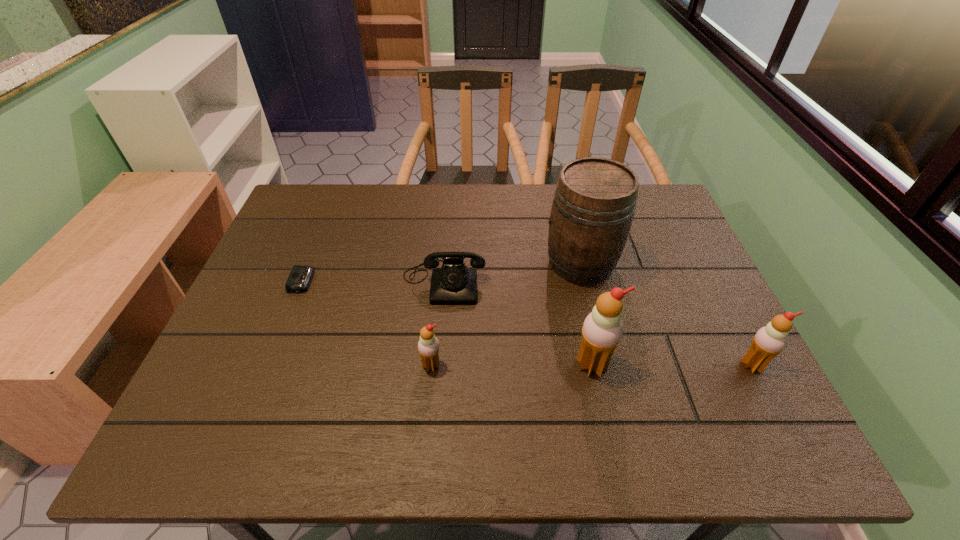
I want to click on free point between the second icecream from right to left and the cider, so click(587, 314).

Locate which object is the fifth closest to the leftmost object. Please provide its 2D coordinates. Your answer should be formatted as a tuple, i.e. [(x, y)], where the tuple contains the x and y coordinates of a point satisfying the conditions above.

[(769, 341)]

Image resolution: width=960 pixels, height=540 pixels. Find the location of `the third closest object relative to the cider`. the third closest object relative to the cider is located at coordinates (769, 341).

Locate an element on the screen. The image size is (960, 540). the second closest icecream to the tallest icecream is located at coordinates (428, 346).

Locate an element on the screen. The width and height of the screenshot is (960, 540). icecream that is the second closest one to the second icecream from right to left is located at coordinates (428, 346).

Where is `vacant space that satisfies the following two spatial constraints: 1. on the side of the cider near the bung hole; 2. at the front with a straw on the tallest icecream`? The width and height of the screenshot is (960, 540). vacant space that satisfies the following two spatial constraints: 1. on the side of the cider near the bung hole; 2. at the front with a straw on the tallest icecream is located at coordinates (605, 365).

You are a GUI agent. You are given a task and a screenshot of the screen. Output one action in this format:
    pyautogui.click(x=<x>, y=<y>)
    Task: Click on the vacant space that satisfies the following two spatial constraints: 1. on the side of the cider near the bung hole; 2. on the front face of the telephone
    This screenshot has width=960, height=540.
    Given the screenshot: What is the action you would take?
    pyautogui.click(x=585, y=281)